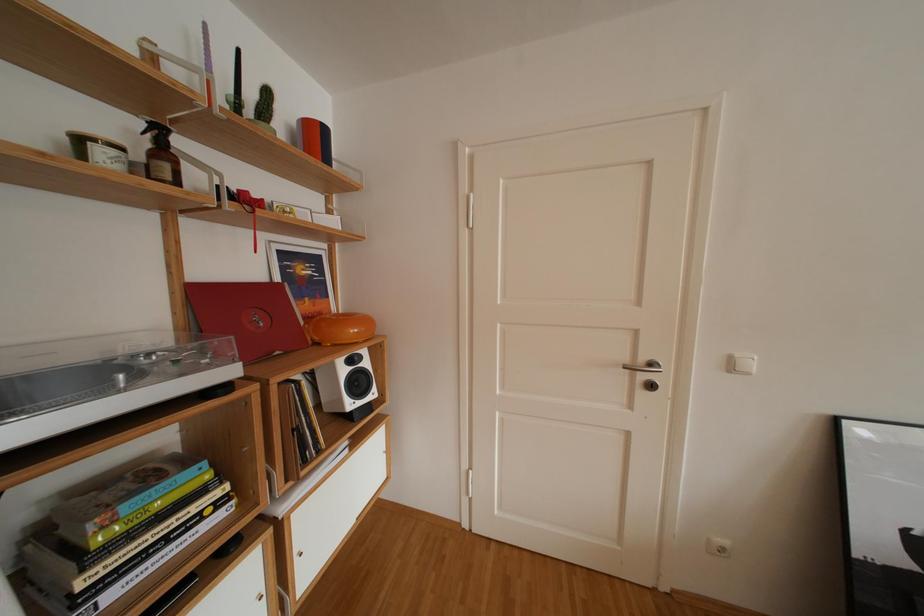
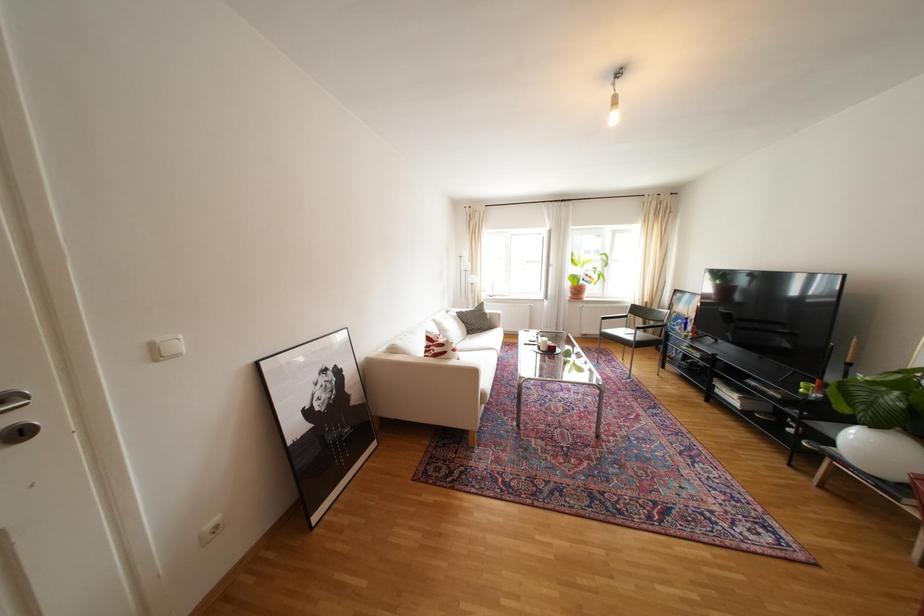
Question: Based on the continuous images, in which direction is the camera rotating? Reply with the corresponding letter.

Choices:
 (A) Left
 (B) Right
 (C) Up
 (D) Down

Answer: (B)